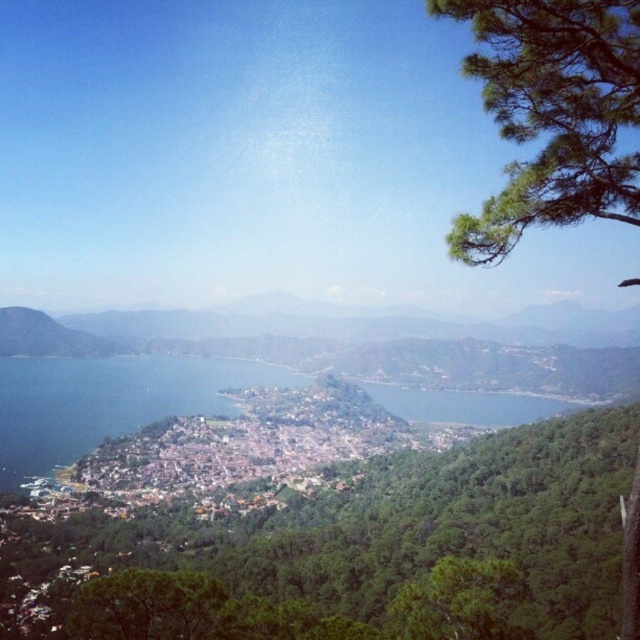
Question: Among these objects, which one is farthest from the camera?

Choices:
 (A) green leafy tree at center
 (B) green needle-like leaves at upper right

Answer: (A)

Question: Does green leafy tree at center have a greater width compared to green needle-like leaves at upper right?

Choices:
 (A) yes
 (B) no

Answer: (A)

Question: Is green leafy tree at center in front of green needle-like leaves at upper right?

Choices:
 (A) no
 (B) yes

Answer: (A)

Question: Can you confirm if green leafy tree at center is positioned above green needle-like leaves at upper right?

Choices:
 (A) yes
 (B) no

Answer: (B)

Question: Which of the following is the farthest from the observer?

Choices:
 (A) green leafy tree at center
 (B) green needle-like leaves at upper right

Answer: (A)